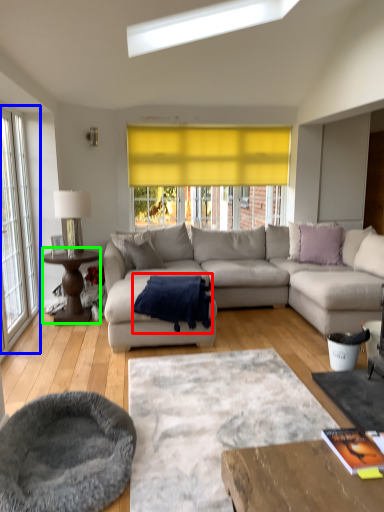
Question: Based on their relative distances, which object is nearer to blanket (highlighted by a red box)? Choose from window (highlighted by a blue box) and coffee table (highlighted by a green box).

Choices:
 (A) window
 (B) coffee table

Answer: (B)